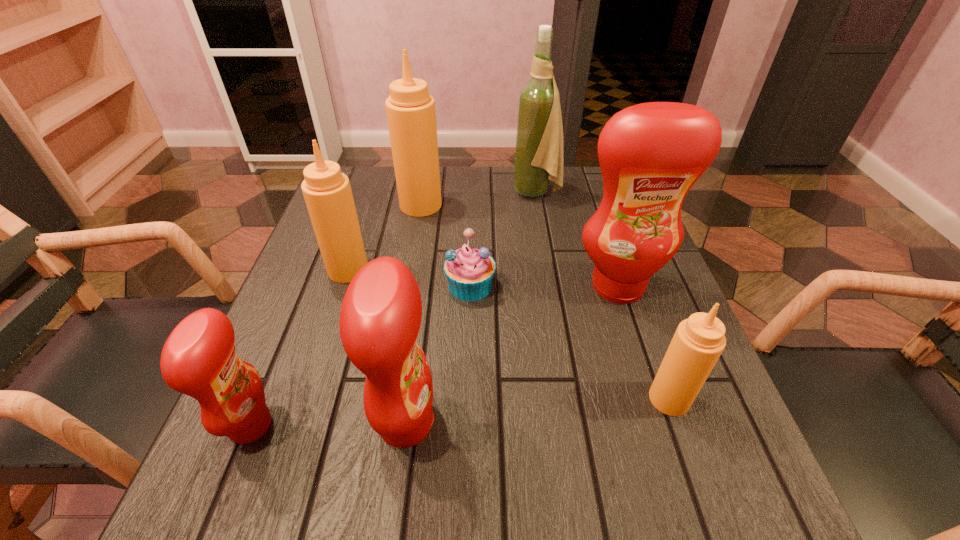
What are the coordinates of `wine bottle` in the screenshot? It's located at (539, 137).

The height and width of the screenshot is (540, 960). In order to click on the rightmost red condiment in this screenshot , I will do `click(651, 154)`.

Where is `the biggest red condiment`? The height and width of the screenshot is (540, 960). the biggest red condiment is located at coordinates (651, 154).

Where is `the biggest tan condiment`? the biggest tan condiment is located at coordinates (410, 109).

The image size is (960, 540). What are the coordinates of `the farthest tan condiment` in the screenshot? It's located at (410, 109).

At what (x,y) coordinates should I click in order to perform the action: click on the second nearest tan condiment. Please return your answer as a coordinate pair (x, y). Looking at the image, I should click on click(327, 192).

I want to click on the second smallest tan condiment, so click(x=327, y=192).

I want to click on the second smallest red condiment, so click(380, 318).

Find the location of a particular element. Image resolution: width=960 pixels, height=540 pixels. the leftmost red condiment is located at coordinates (199, 359).

Find the location of a particular element. the rightmost tan condiment is located at coordinates (698, 342).